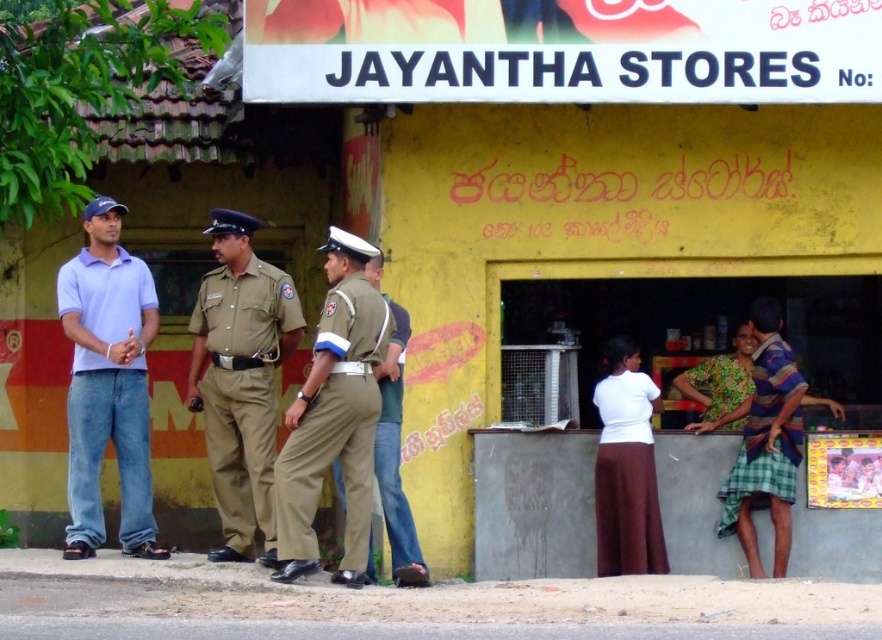
You are a photographer taking a picture of the street scene in front of Jayantha Stores. You notice the khaki fabric pants at center and the brown cotton skirt at lower center. Which of these items is positioned closer to the camera?

The khaki fabric pants at center is closer to the viewer than the brown cotton skirt at lower center.